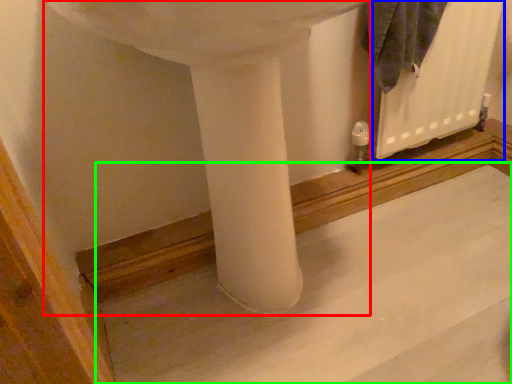
Question: Estimate the real-world distances between objects in this image. Which object is farther from sink (highlighted by a red box), radiator (highlighted by a blue box) or concrete (highlighted by a green box)?

Choices:
 (A) radiator
 (B) concrete

Answer: (A)